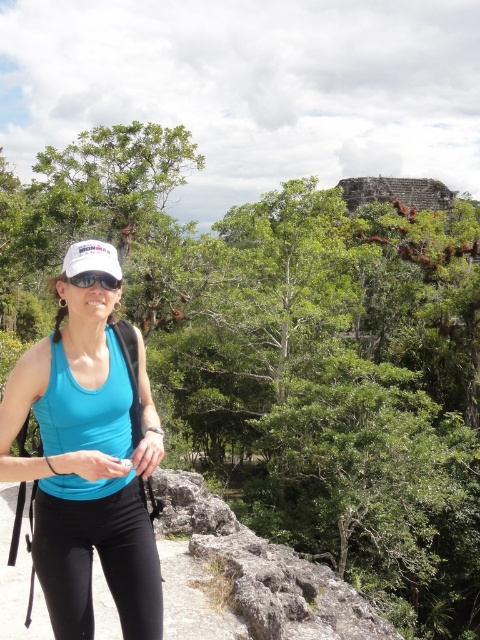
Question: Observing the image, what is the correct spatial positioning of matte blue tank top at center in reference to matte black goggles at center?

Choices:
 (A) right
 (B) left

Answer: (B)

Question: Among these points, which one is farthest from the camera?

Choices:
 (A) (152, 598)
 (B) (91, 285)
 (C) (131, 404)
 (D) (157, 637)

Answer: (C)

Question: Which point is farther from the camera taking this photo?

Choices:
 (A) coord(94,272)
 (B) coord(148,577)
 (C) coord(61,316)

Answer: (C)

Question: Is black matte leggings at lower left positioned before matte black goggles at center?

Choices:
 (A) yes
 (B) no

Answer: (A)

Question: Which point is closer to the camera?

Choices:
 (A) matte blue tank top at center
 (B) black matte leggings at lower left

Answer: (B)

Question: Is matte blue tank top at center wider than blue fabric tank top at center?

Choices:
 (A) no
 (B) yes

Answer: (A)